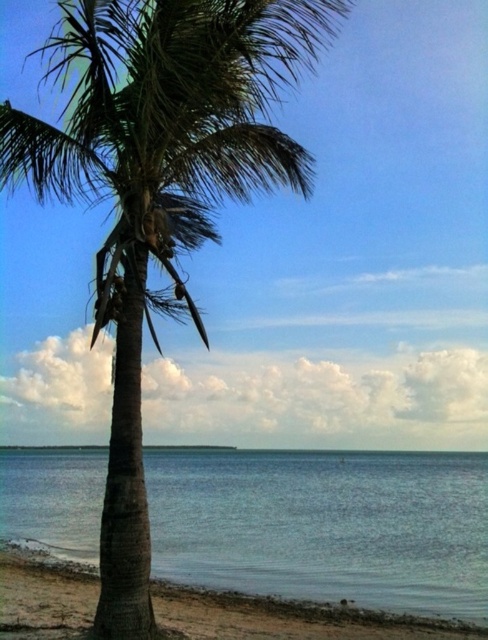
Is point (269, 84) more distant than point (195, 611)?

Yes, it is behind point (195, 611).

Between green leafy coconut tree at center and sandy brown beach at lower left, which one has more height?

green leafy coconut tree at center is taller.

Is point (173, 241) closer to viewer compared to point (253, 630)?

Yes, it is.

Where is `green leafy coconut tree at center`? The width and height of the screenshot is (488, 640). green leafy coconut tree at center is located at coordinates (159, 189).

Who is more forward, [278,134] or [377,586]?

Point [278,134]

Which is below, green leafy coconut tree at center or blue water at center?

blue water at center is lower down.

Is point (80, 134) positioned in front of point (187, 529)?

Yes.

Locate an element on the screen. green leafy coconut tree at center is located at coordinates (159, 189).

Is blue water at center above sandy brown beach at lower left?

No.

Which is behind, point (312, 452) or point (411, 620)?

The point (312, 452) is behind.

Does point (352, 541) come in front of point (248, 621)?

No.

Locate an element on the screen. Image resolution: width=488 pixels, height=640 pixels. blue water at center is located at coordinates (325, 524).